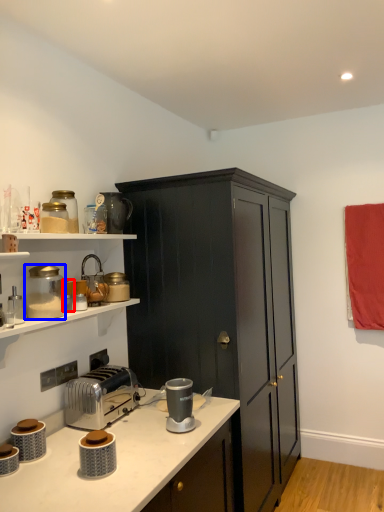
Question: Which point is further to the camera, appliance (highlighted by a red box) or appliance (highlighted by a blue box)?

Choices:
 (A) appliance
 (B) appliance

Answer: (A)